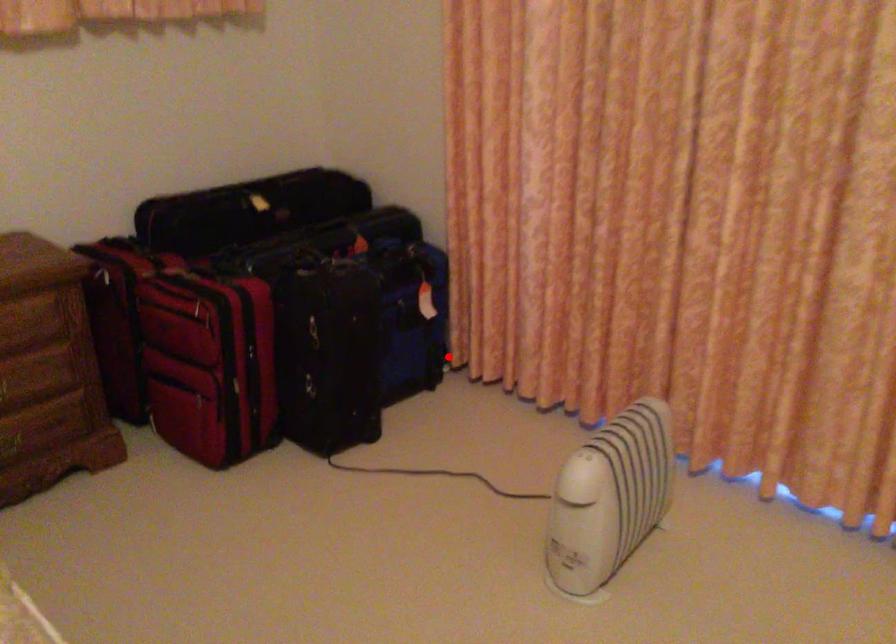
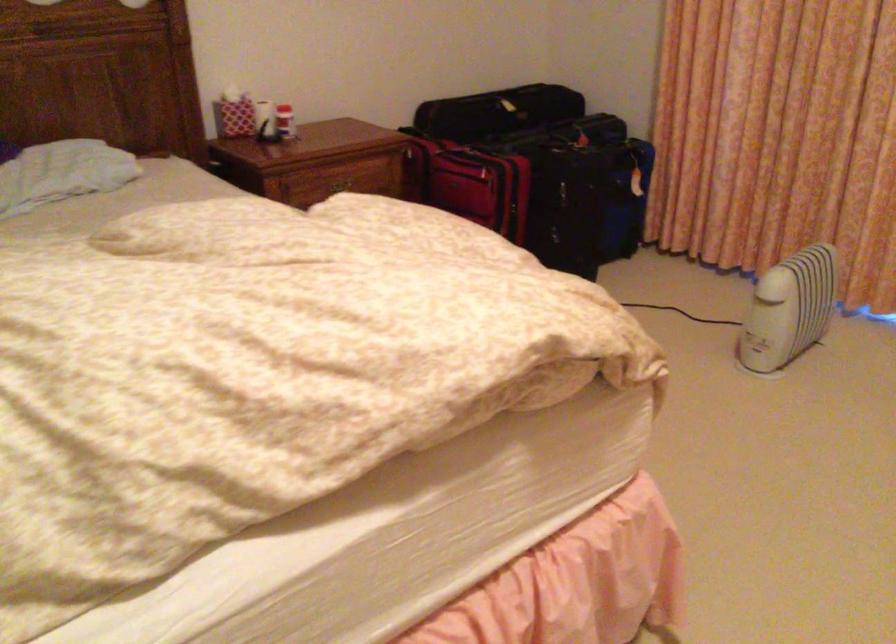
Question: I am providing you with two images of the same scene from different viewpoints. A red point is shown in image1. For the corresponding object point in image2, is it positioned nearer or farther from the camera?

Choices:
 (A) Nearer
 (B) Farther

Answer: (B)